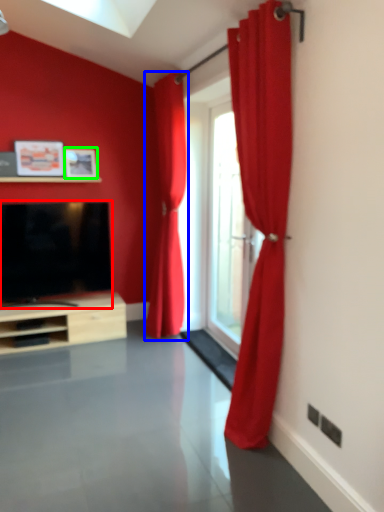
Question: Estimate the real-world distances between objects in this image. Which object is farther from television (highlighted by a red box), curtain (highlighted by a blue box) or picture frame (highlighted by a green box)?

Choices:
 (A) curtain
 (B) picture frame

Answer: (A)